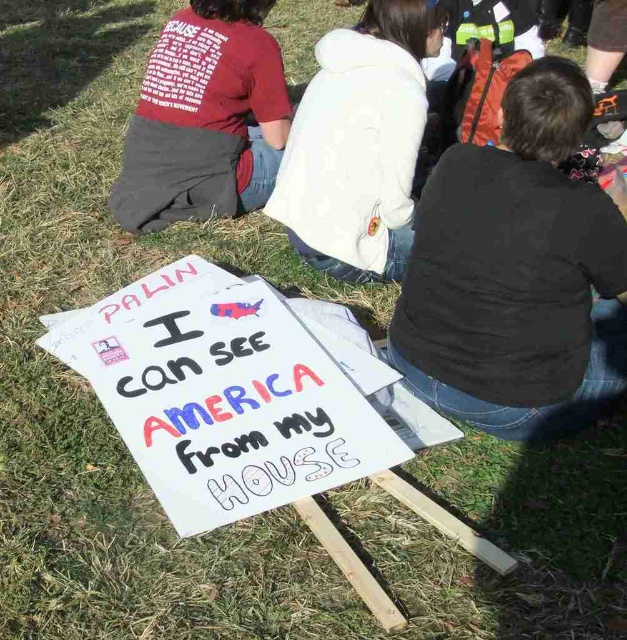
Which is more to the left, black cotton shirt at center or matte red t-shirt at upper left?

matte red t-shirt at upper left is more to the left.

This screenshot has height=640, width=627. Describe the element at coordinates (517, 273) in the screenshot. I see `black cotton shirt at center` at that location.

Does point (403, 317) come closer to viewer compared to point (124, 204)?

That is True.

I want to click on black cotton shirt at center, so click(x=517, y=273).

Does black cotton shirt at center have a larger size compared to white paper sign at center?

Actually, black cotton shirt at center might be smaller than white paper sign at center.

Who is positioned more to the right, black cotton shirt at center or white paper sign at center?

black cotton shirt at center

This screenshot has width=627, height=640. Describe the element at coordinates (517, 273) in the screenshot. I see `black cotton shirt at center` at that location.

At what (x,y) coordinates should I click in order to perform the action: click on black cotton shirt at center. Please return your answer as a coordinate pair (x, y). This screenshot has width=627, height=640. Looking at the image, I should click on (517, 273).

Between white fleece jacket at center and matte red t-shirt at upper left, which one has less height?

With less height is matte red t-shirt at upper left.

Is point (393, 269) in front of point (192, 92)?

Yes, point (393, 269) is in front of point (192, 92).

What do you see at coordinates (359, 144) in the screenshot?
I see `white fleece jacket at center` at bounding box center [359, 144].

You are a GUI agent. You are given a task and a screenshot of the screen. Output one action in this format:
    pyautogui.click(x=<x>, y=<y>)
    Task: Click on the white fleece jacket at center
    
    Given the screenshot: What is the action you would take?
    pyautogui.click(x=359, y=144)